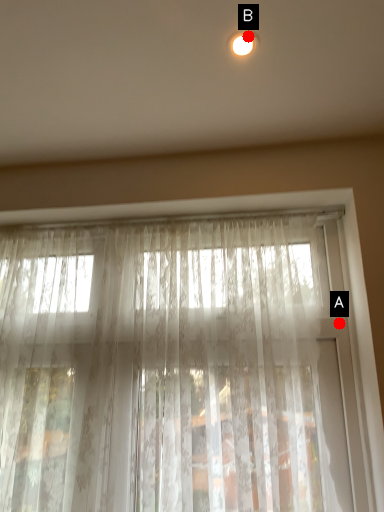
Question: Two points are circled on the image, labeled by A and B beside each circle. Which point is closer to the camera?

Choices:
 (A) A is closer
 (B) B is closer

Answer: (B)